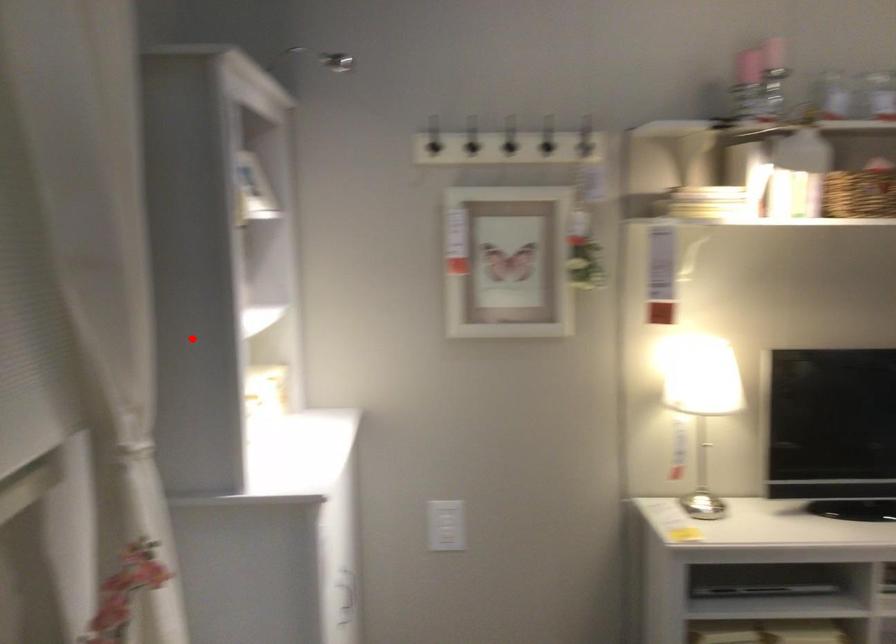
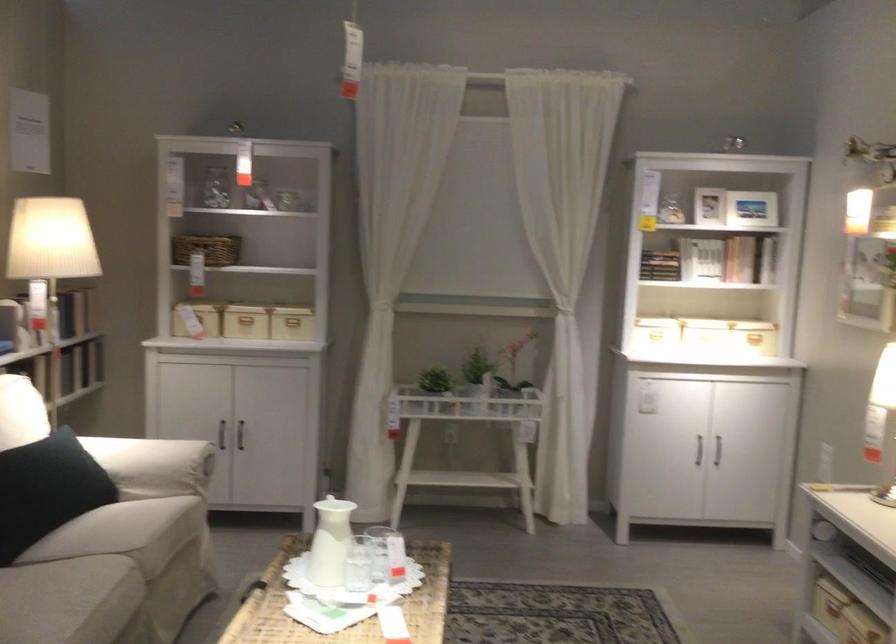
Question: I am providing you with two images of the same scene from different viewpoints. Image1 has a red point marked. In image2, the corresponding 3D location appears at what relative position? Reply with the corresponding letter.

Choices:
 (A) Closer
 (B) Farther

Answer: (B)